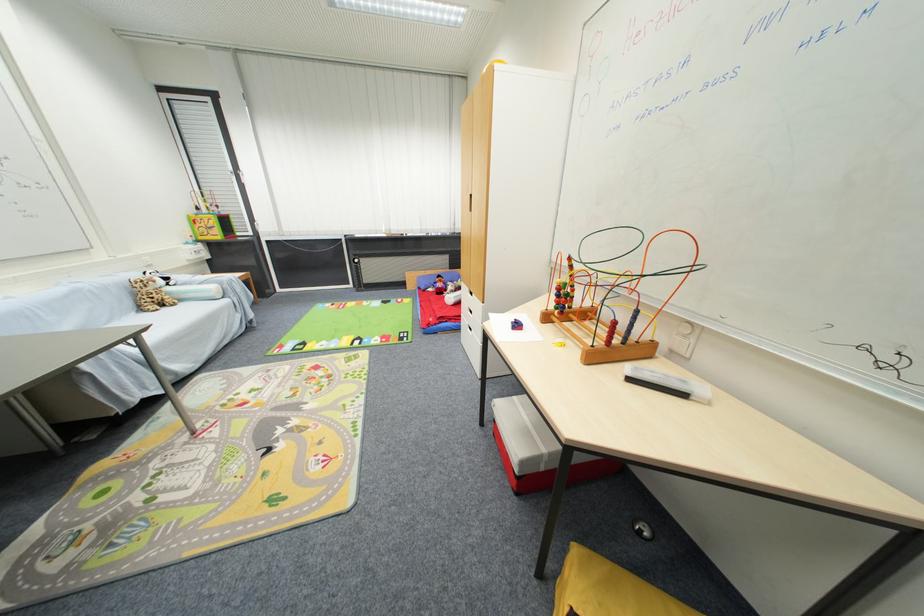
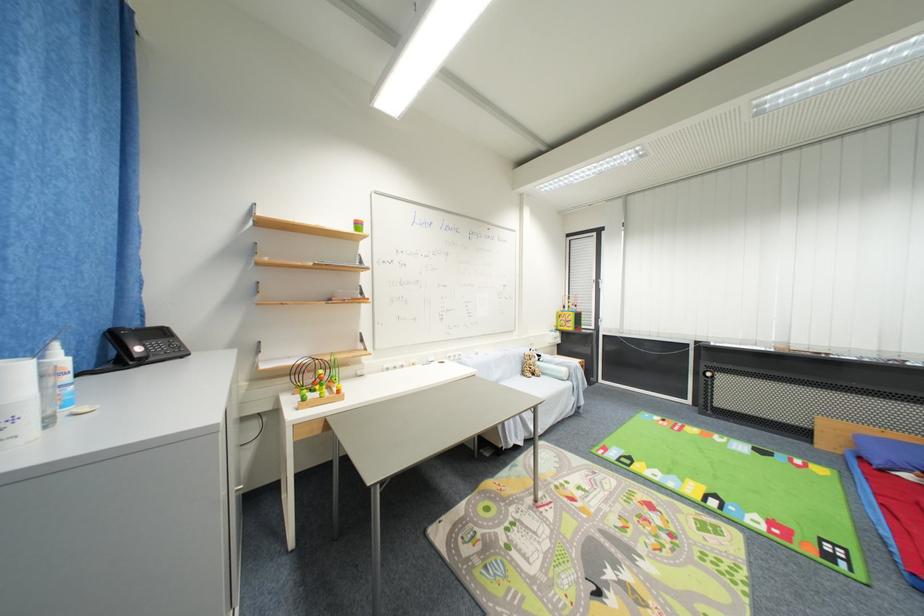
Question: The images are taken continuously from a first-person perspective. In which direction is your viewpoint rotating?

Choices:
 (A) Left
 (B) Right
 (C) Up
 (D) Down

Answer: (A)